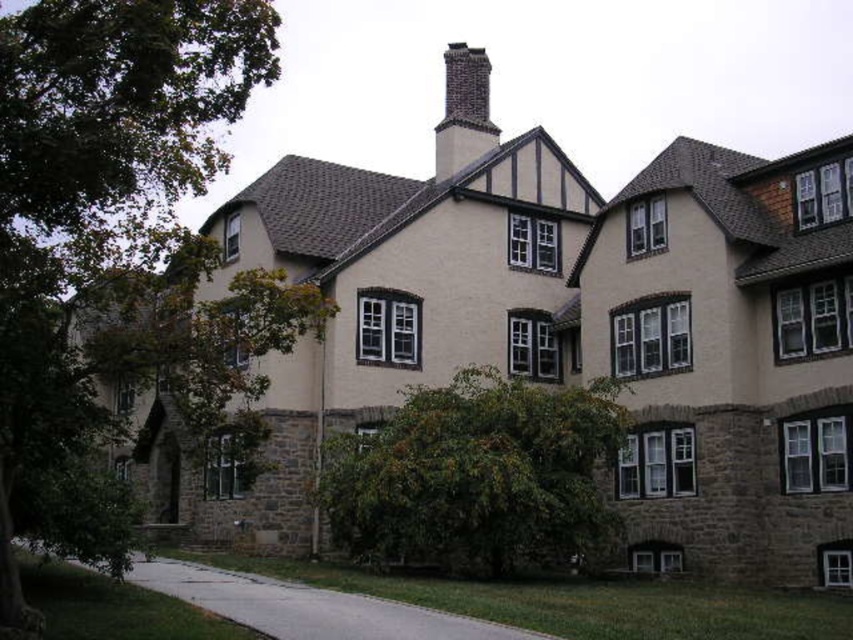
Question: Which of the following is the closest to the observer?

Choices:
 (A) (433, 609)
 (B) (532, 422)

Answer: (A)

Question: Can you confirm if green leafy bush at center is positioned below dark gray brick chimney at upper center?

Choices:
 (A) yes
 (B) no

Answer: (A)

Question: Which point is farther from the camera taking this photo?

Choices:
 (A) (50, 404)
 (B) (445, 547)
 (C) (463, 49)
 (D) (138, 573)

Answer: (C)

Question: Is gray concrete driveway at lower center positioned in front of dark gray brick chimney at upper center?

Choices:
 (A) no
 (B) yes

Answer: (B)

Question: Considering the relative positions of green leafy bush at center and dark gray brick chimney at upper center in the image provided, where is green leafy bush at center located with respect to dark gray brick chimney at upper center?

Choices:
 (A) above
 (B) below

Answer: (B)

Question: Among these objects, which one is farthest from the camera?

Choices:
 (A) gray concrete driveway at lower center
 (B) green leafy bush at center
 (C) dark gray brick chimney at upper center
 (D) green leafy tree at left

Answer: (C)